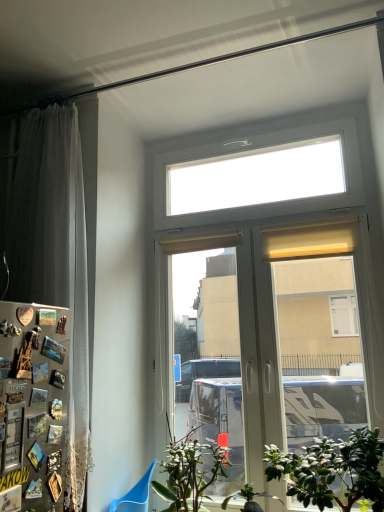
What is the approximate height of green matte plant at lower center, which is the 1th houseplant from left to right?

green matte plant at lower center, which is the 1th houseplant from left to right, is 17.71 inches in height.

The width and height of the screenshot is (384, 512). Describe the element at coordinates (190, 472) in the screenshot. I see `green matte plant at lower center, the third houseplant positioned from the right` at that location.

Where is `green leafy plant at lower right, the 1th houseplant in the right-to-left sequence`? The width and height of the screenshot is (384, 512). green leafy plant at lower right, the 1th houseplant in the right-to-left sequence is located at coordinates tap(332, 470).

What do you see at coordinates (135, 495) in the screenshot? Image resolution: width=384 pixels, height=512 pixels. I see `blue plastic armchair at lower left` at bounding box center [135, 495].

What are the coordinates of `white plastic window at center` in the screenshot? It's located at (277, 258).

Consider the image. Does green matte plant at lower center, which is the 1th houseplant from left to right, have a greater width compared to green leafy plant at lower center, which is the second houseplant from right to left?

Yes.

Which is in front, green matte plant at lower center, the third houseplant positioned from the right, or green leafy plant at lower center, the 2th houseplant positioned from the left?

Positioned in front is green leafy plant at lower center, the 2th houseplant positioned from the left.

Is green matte plant at lower center, which is the 1th houseplant from left to right, turned away from green leafy plant at lower center, which is the second houseplant from right to left?

No, green matte plant at lower center, which is the 1th houseplant from left to right, is not facing away from green leafy plant at lower center, which is the second houseplant from right to left.

Could you tell me if green leafy plant at lower center, the 2th houseplant positioned from the left, is facing white plastic window at center?

No, green leafy plant at lower center, the 2th houseplant positioned from the left, does not turn towards white plastic window at center.

Does point (260, 493) appear closer or farther from the camera than point (224, 148)?

Point (260, 493) appears to be closer to the viewer than point (224, 148).

Is green leafy plant at lower center, which is the second houseplant from right to left, positioned before white plastic window at center?

Yes, it is in front of white plastic window at center.

How distant is green leafy plant at lower center, which is the second houseplant from right to left, from white plastic window at center?

A distance of 36.70 inches exists between green leafy plant at lower center, which is the second houseplant from right to left, and white plastic window at center.

From a real-world perspective, which object rests below the other?

metallic silver fridge at left.

Is metallic silver fridge at left outside of white plastic window at center?

Yes, metallic silver fridge at left is located beyond the bounds of white plastic window at center.

Does point (62, 338) come behind point (337, 214)?

No, it is not.

This screenshot has width=384, height=512. I want to click on curtain above the green leafy plant at lower right, which is the third houseplant in left-to-right order (from a real-world perspective), so click(56, 257).

Is green leafy plant at lower right, the 1th houseplant in the right-to-left sequence, bigger or smaller than white sheer curtain at left?

Clearly, green leafy plant at lower right, the 1th houseplant in the right-to-left sequence, is smaller in size than white sheer curtain at left.

Is green leafy plant at lower right, which is the third houseplant in left-to-right order, wider than white sheer curtain at left?

Yes, green leafy plant at lower right, which is the third houseplant in left-to-right order, is wider than white sheer curtain at left.

From the image's perspective, between green leafy plant at lower right, which is the third houseplant in left-to-right order, and white sheer curtain at left, who is located below?

From the image's view, green leafy plant at lower right, which is the third houseplant in left-to-right order, is below.

Which is nearer, (362, 316) or (35, 127)?

Point (362, 316) is positioned closer to the camera compared to point (35, 127).

From a real-world perspective, is white plastic window at center on top of white sheer curtain at left?

Actually, white plastic window at center is physically below white sheer curtain at left in the real world.

Does white plastic window at center come in front of white sheer curtain at left?

No, white plastic window at center is further to the viewer.

This screenshot has width=384, height=512. In order to click on the 2nd houseplant located beneath the white sheer curtain at left (from a real-world perspective) in this screenshot , I will do `click(190, 472)`.

Is white sheer curtain at left not inside green matte plant at lower center, the third houseplant positioned from the right?

Yes.

Would you consider white sheer curtain at left to be distant from green matte plant at lower center, the third houseplant positioned from the right?

That's not correct — white sheer curtain at left is a little close to green matte plant at lower center, the third houseplant positioned from the right.

Which object is wider, white sheer curtain at left or green matte plant at lower center, which is the 1th houseplant from left to right?

With larger width is green matte plant at lower center, which is the 1th houseplant from left to right.

Does green leafy plant at lower right, which is the third houseplant in left-to-right order, appear on the left side of green leafy plant at lower center, the 2th houseplant positioned from the left?

In fact, green leafy plant at lower right, which is the third houseplant in left-to-right order, is to the right of green leafy plant at lower center, the 2th houseplant positioned from the left.

Is green leafy plant at lower right, which is the third houseplant in left-to-right order, aimed at green leafy plant at lower center, which is the second houseplant from right to left?

No.

How far apart are green leafy plant at lower right, the 1th houseplant in the right-to-left sequence, and green leafy plant at lower center, which is the second houseplant from right to left?

The distance of green leafy plant at lower right, the 1th houseplant in the right-to-left sequence, from green leafy plant at lower center, which is the second houseplant from right to left, is 13.20 inches.

This screenshot has height=512, width=384. In order to click on houseplant that is behind the green leafy plant at lower center, the 2th houseplant positioned from the left in this screenshot , I will do `click(190, 472)`.

Identify the location of houseplant that is the 3rd object located below the white plastic window at center (from the image's perspective). The image size is (384, 512). (249, 498).

Looking at the image, which one is located further to white plastic window at center, green leafy plant at lower right, the 1th houseplant in the right-to-left sequence, or green leafy plant at lower center, the 2th houseplant positioned from the left?

Among the two, green leafy plant at lower center, the 2th houseplant positioned from the left, is located further to white plastic window at center.

Looking at the image, which one is located further to green leafy plant at lower right, which is the third houseplant in left-to-right order, green matte plant at lower center, the third houseplant positioned from the right, or green leafy plant at lower center, which is the second houseplant from right to left?

green matte plant at lower center, the third houseplant positioned from the right.

Looking at the image, which one is located further to blue plastic armchair at lower left, green leafy plant at lower center, the 2th houseplant positioned from the left, or green matte plant at lower center, which is the 1th houseplant from left to right?

Based on the image, green leafy plant at lower center, the 2th houseplant positioned from the left, appears to be further to blue plastic armchair at lower left.

From the image, which object appears to be nearer to white sheer curtain at left, green matte plant at lower center, the third houseplant positioned from the right, or metallic silver fridge at left?

metallic silver fridge at left is positioned closer to the anchor white sheer curtain at left.

Looking at the image, which one is located closer to blue plastic armchair at lower left, green leafy plant at lower center, which is the second houseplant from right to left, or white sheer curtain at left?

green leafy plant at lower center, which is the second houseplant from right to left, is closer to blue plastic armchair at lower left.

Based on the photo, based on their spatial positions, is blue plastic armchair at lower left or white plastic window at center further from green leafy plant at lower center, which is the second houseplant from right to left?

white plastic window at center lies further to green leafy plant at lower center, which is the second houseplant from right to left, than the other object.

Which object lies nearer to the anchor point white sheer curtain at left, blue plastic armchair at lower left or green leafy plant at lower right, the 1th houseplant in the right-to-left sequence?

The object closer to white sheer curtain at left is blue plastic armchair at lower left.

Estimate the real-world distances between objects in this image. Which object is closer to green leafy plant at lower center, which is the second houseplant from right to left, white plastic window at center or green matte plant at lower center, the third houseplant positioned from the right?

green matte plant at lower center, the third houseplant positioned from the right, lies closer to green leafy plant at lower center, which is the second houseplant from right to left, than the other object.

Locate an element on the screen. This screenshot has height=512, width=384. fridge located between white sheer curtain at left and white plastic window at center in the left-right direction is located at coordinates (33, 406).

Where is `armchair between metallic silver fridge at left and green leafy plant at lower right, which is the third houseplant in left-to-right order`? Image resolution: width=384 pixels, height=512 pixels. armchair between metallic silver fridge at left and green leafy plant at lower right, which is the third houseplant in left-to-right order is located at coordinates (135, 495).

Where is `window between white sheer curtain at left and blue plastic armchair at lower left in the up-down direction`? This screenshot has height=512, width=384. window between white sheer curtain at left and blue plastic armchair at lower left in the up-down direction is located at coordinates (277, 258).

Locate an element on the screen. fridge between white sheer curtain at left and green leafy plant at lower right, the 1th houseplant in the right-to-left sequence, in the horizontal direction is located at coordinates (33, 406).